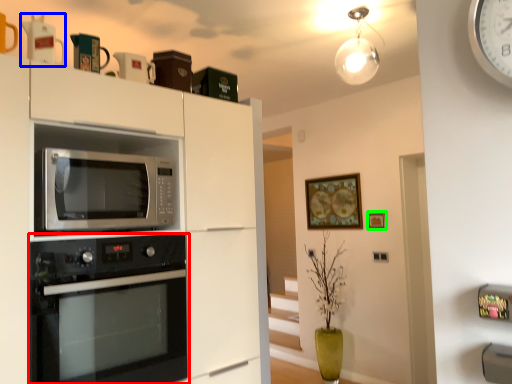
Question: Which object is positioned farthest from oven (highlighted by a red box)? Select from appliance (highlighted by a blue box) and picture frame (highlighted by a green box).

Choices:
 (A) appliance
 (B) picture frame

Answer: (B)